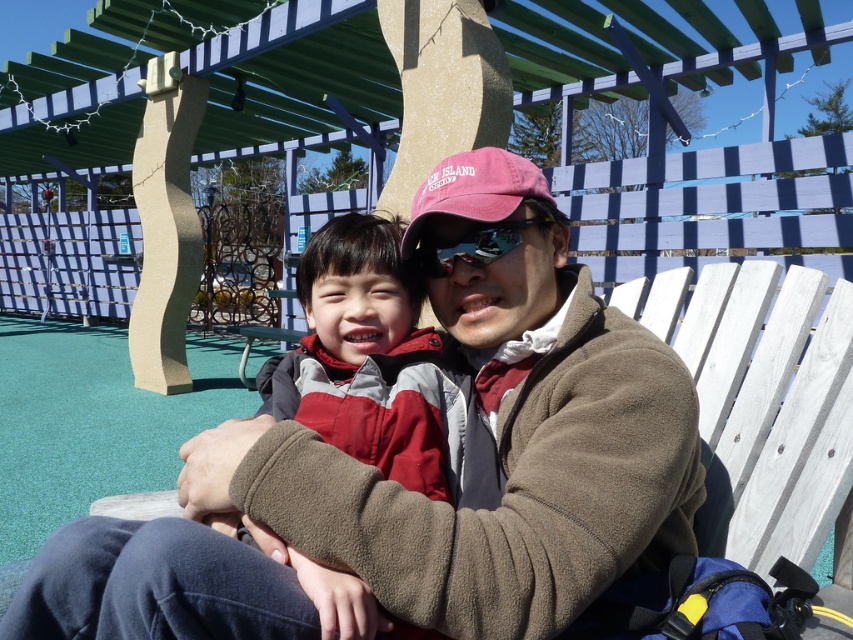
Does red fleece jacket at center have a smaller size compared to maroon fabric baseball cap at center?

Yes.

Between red fleece jacket at center and maroon fabric baseball cap at center, which one appears on the left side from the viewer's perspective?

red fleece jacket at center

Identify the location of red fleece jacket at center. The width and height of the screenshot is (853, 640). (369, 358).

In the scene shown: Can you confirm if brown fleece jacket at center is positioned to the left of maroon fabric baseball cap at center?

Yes, brown fleece jacket at center is to the left of maroon fabric baseball cap at center.

Identify the location of brown fleece jacket at center. (415, 490).

This screenshot has height=640, width=853. In order to click on brown fleece jacket at center in this screenshot , I will do `click(415, 490)`.

Is maroon fabric baseball cap at center positioned behind sunglasses at center?

No, it is not.

Between maroon fabric baseball cap at center and sunglasses at center, which one appears on the left side from the viewer's perspective?

From the viewer's perspective, maroon fabric baseball cap at center appears more on the left side.

Does point (467, 209) come farther from viewer compared to point (480, 230)?

That is False.

The image size is (853, 640). What are the coordinates of `maroon fabric baseball cap at center` in the screenshot? It's located at (474, 189).